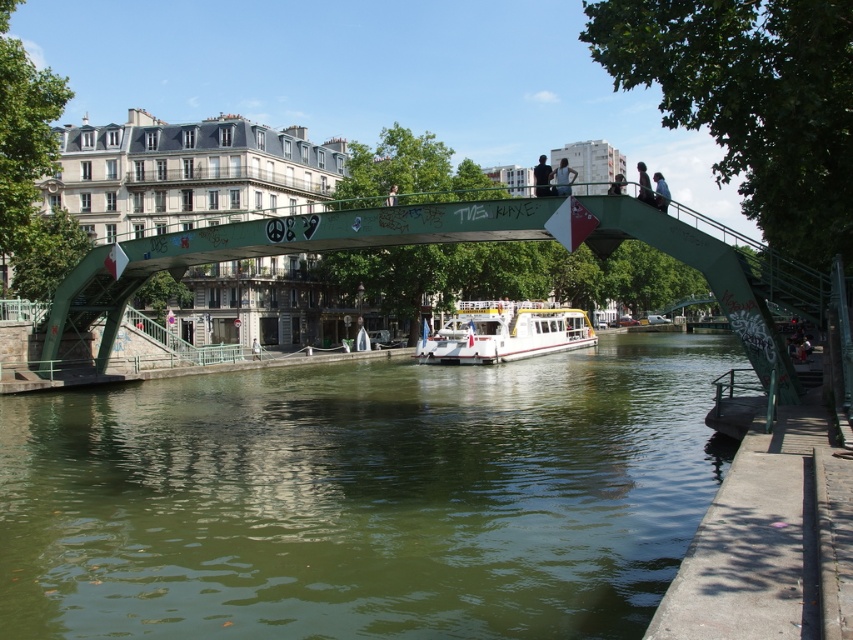
Question: Based on their relative distances, which object is nearer to the white plastic boat at center?

Choices:
 (A) light blue shirt at upper center
 (B) dark blue jeans at upper center
 (C) green water at center

Answer: (C)

Question: Can you confirm if dark blue jeans at upper center is positioned below light blue shirt at upper center?

Choices:
 (A) no
 (B) yes

Answer: (A)

Question: Estimate the real-world distances between objects in this image. Which object is farther from the dark blue jeans at upper center?

Choices:
 (A) black fabric person at upper center
 (B) green painted metal pedestrian bridge at center
 (C) light blue shirt at upper center

Answer: (B)

Question: Considering the relative positions of white plastic boat at center and black fabric person at upper center in the image provided, where is white plastic boat at center located with respect to black fabric person at upper center?

Choices:
 (A) left
 (B) right

Answer: (A)

Question: Is the position of green water at center more distant than that of dark blue jeans at upper center?

Choices:
 (A) no
 (B) yes

Answer: (A)

Question: Estimate the real-world distances between objects in this image. Which object is farther from the green water at center?

Choices:
 (A) white plastic boat at center
 (B) black fabric person at upper center
 (C) dark blue jeans at upper center
 (D) green painted metal pedestrian bridge at center

Answer: (A)